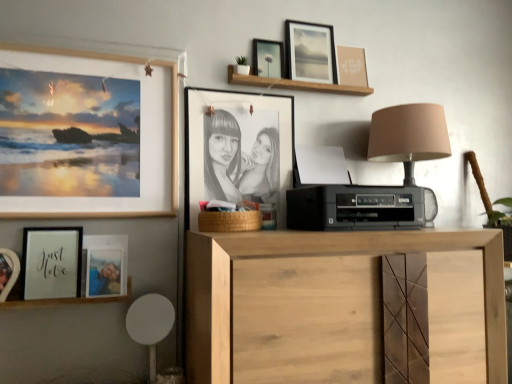
I want to click on empty space that is ontop of wooden picture frame at upper left, placed as the 3th picture frame when sorted from left to right (from a real-world perspective), so click(x=91, y=49).